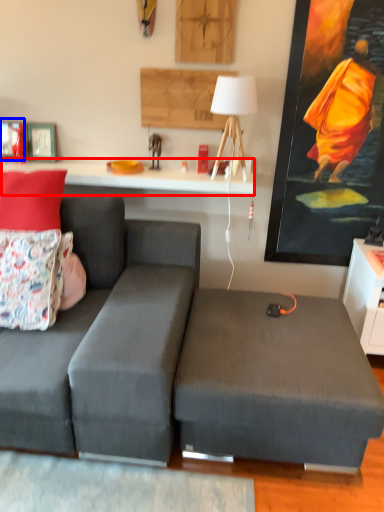
Question: Which object is closer to the camera taking this photo, table (highlighted by a red box) or picture frame (highlighted by a blue box)?

Choices:
 (A) table
 (B) picture frame

Answer: (A)